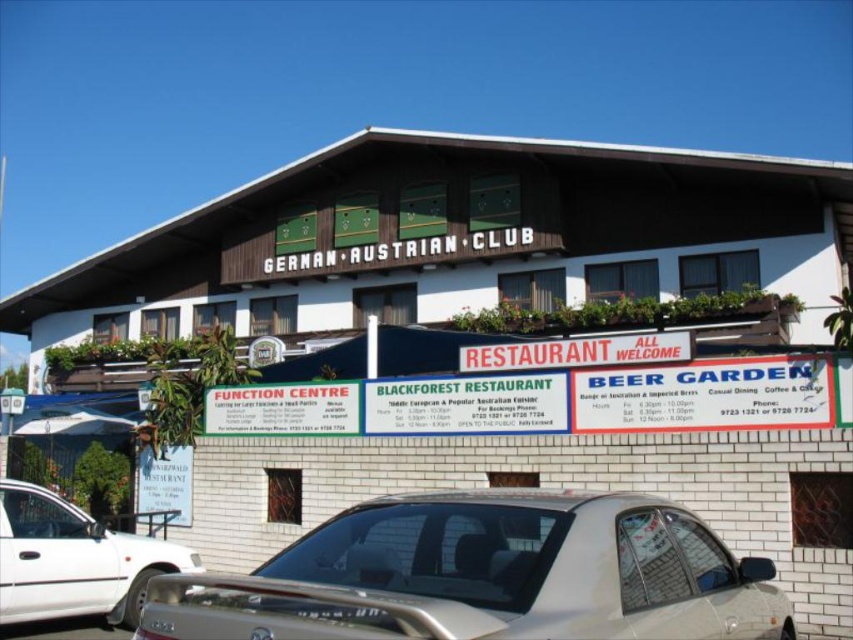
Question: Which of the following is the closest to the observer?

Choices:
 (A) (7, 483)
 (B) (573, 525)

Answer: (B)

Question: Which of the following is the farthest from the observer?

Choices:
 (A) white plastic signboard at center
 (B) silver metallic car at center
 (C) white glossy sedan at lower left

Answer: (A)

Question: Which object appears farthest from the camera in this image?

Choices:
 (A) white plastic signboard at center
 (B) white glossy sedan at lower left
 (C) silver metallic car at center

Answer: (A)

Question: Can you confirm if silver metallic car at center is thinner than white glossy sedan at lower left?

Choices:
 (A) no
 (B) yes

Answer: (A)

Question: Considering the relative positions of silver metallic car at center and white plastic signboard at center in the image provided, where is silver metallic car at center located with respect to white plastic signboard at center?

Choices:
 (A) above
 (B) below

Answer: (B)

Question: Does white glossy sedan at lower left come behind white plastic signboard at center?

Choices:
 (A) no
 (B) yes

Answer: (A)